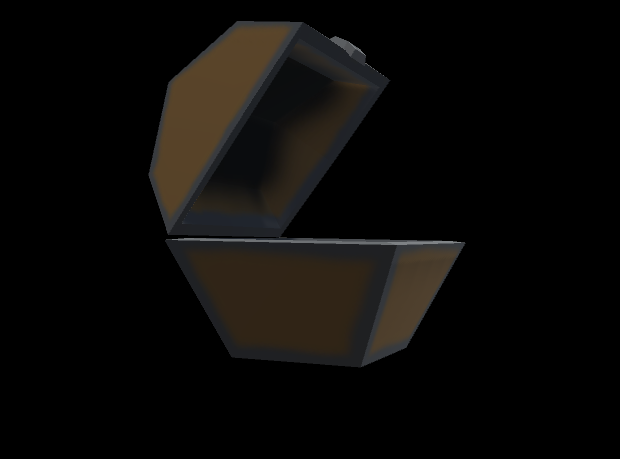
Identify the location of shadows on chest lid. (260, 146).